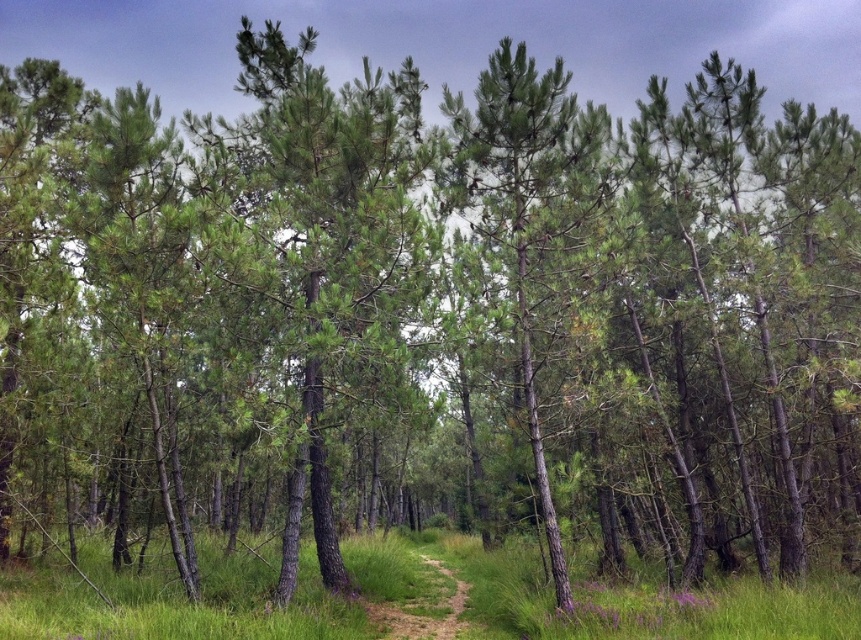
You are standing at the point marked by the coordinates point (332, 259) in the forest. What type of vegetation is directly under your feet?

The green needle like vegetation at center is represented by point (332, 259), so the vegetation directly under your feet is green needle like.

You are a hiker with a 1.2 meter wide tent. You come across a narrow dirt path in the forest. The path is flanked by green grass at center and green textured pine tree at center. Can your tent fit between them without touching either?

The green grass at center is bigger than the green textured pine tree at center, so the space between them may be insufficient for a 1.2 meter wide tent. Check the actual distance before setting up.